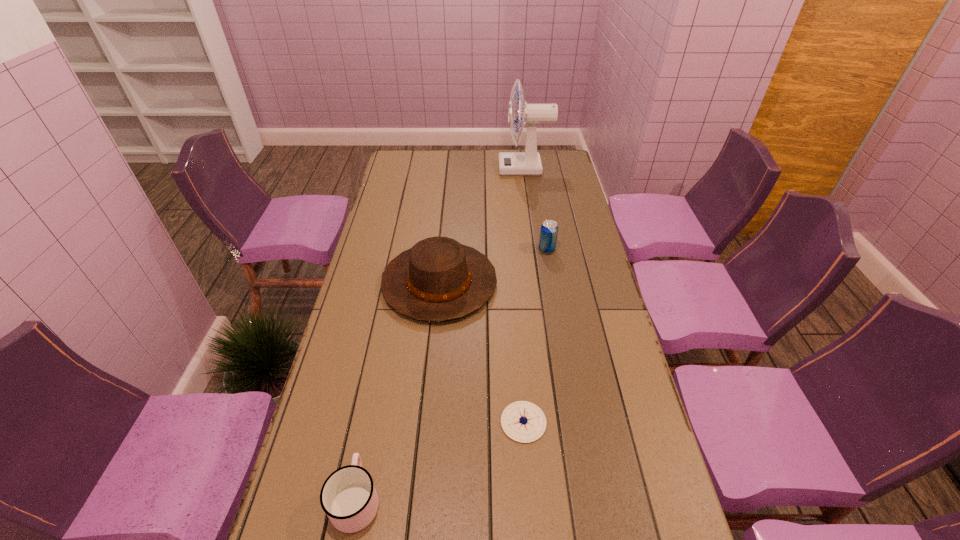
Locate an element on the screen. fan is located at coordinates (528, 163).

This screenshot has height=540, width=960. Identify the location of the farthest object. (528, 163).

Where is `cowboy hat`? The width and height of the screenshot is (960, 540). cowboy hat is located at coordinates (439, 279).

Identify the location of the third tallest object. The height and width of the screenshot is (540, 960). (549, 230).

Identify the location of the nearest object. (348, 496).

The height and width of the screenshot is (540, 960). I want to click on the fourth tallest object, so click(348, 496).

At what (x,y) coordinates should I click in order to perform the action: click on compass. Please return your answer as a coordinate pair (x, y). Looking at the image, I should click on (522, 421).

Locate an element on the screen. The width and height of the screenshot is (960, 540). the shortest object is located at coordinates (522, 421).

This screenshot has width=960, height=540. What are the coordinates of `free space located 0.130m on the front-facing side of the farthest object` in the screenshot? It's located at (471, 168).

This screenshot has height=540, width=960. Find the location of `vacant space positioned on the front-facing side of the farthest object`. vacant space positioned on the front-facing side of the farthest object is located at coordinates (419, 168).